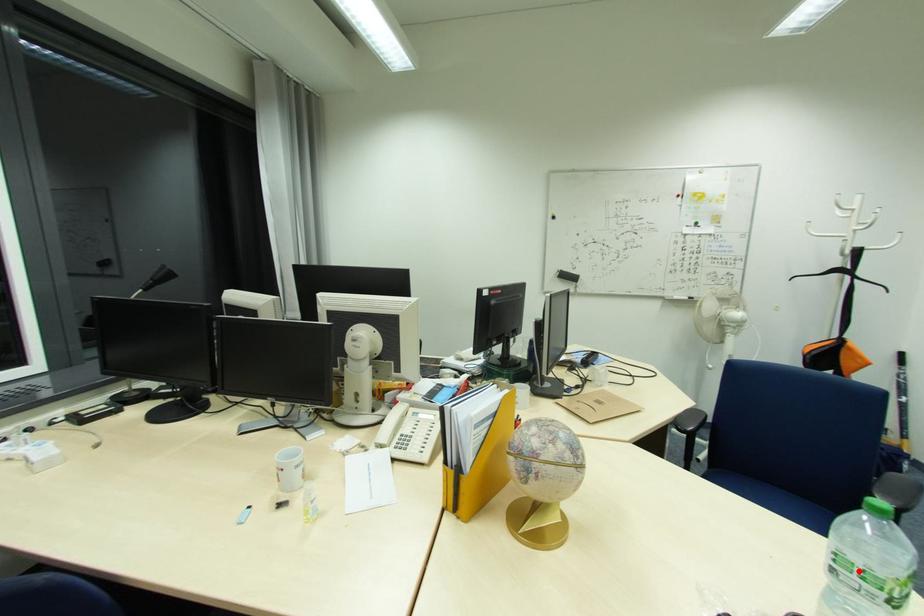
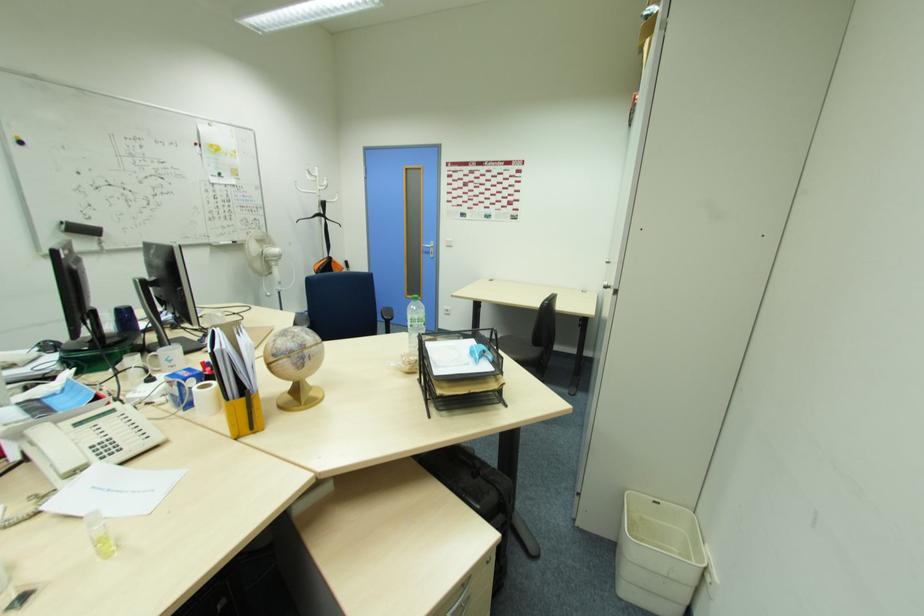
In the second image, find the point that corresponds to the highlighted location in the first image.

(419, 322)